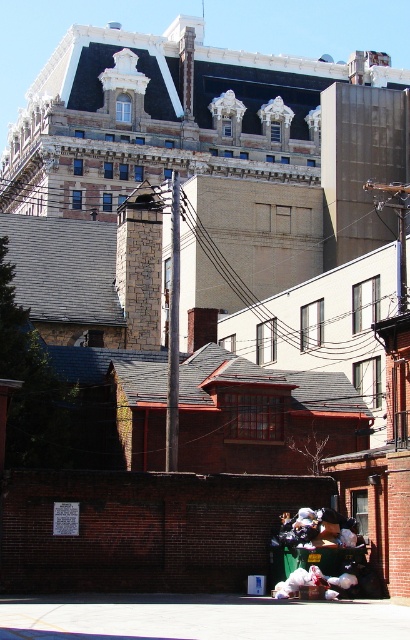
You are a city planner assessing the space between the smooth gray pole at center and the black plastic bags at lower center. Can you determine if the pole is wider than the bags?

The smooth gray pole at center is wider than the black plastic bags at lower center because its width surpasses theirs.

You are standing in front of the brick wall and notice the smooth gray pole at center and the black plastic bags at lower center. Which object is positioned to the left of the other?

The smooth gray pole at center is to the left of black plastic bags at lower center.